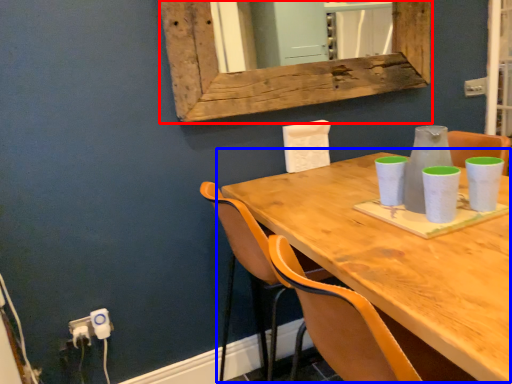
Question: Which of the following is the closest to the observer, window frame (highlighted by a red box) or table (highlighted by a blue box)?

Choices:
 (A) window frame
 (B) table

Answer: (B)